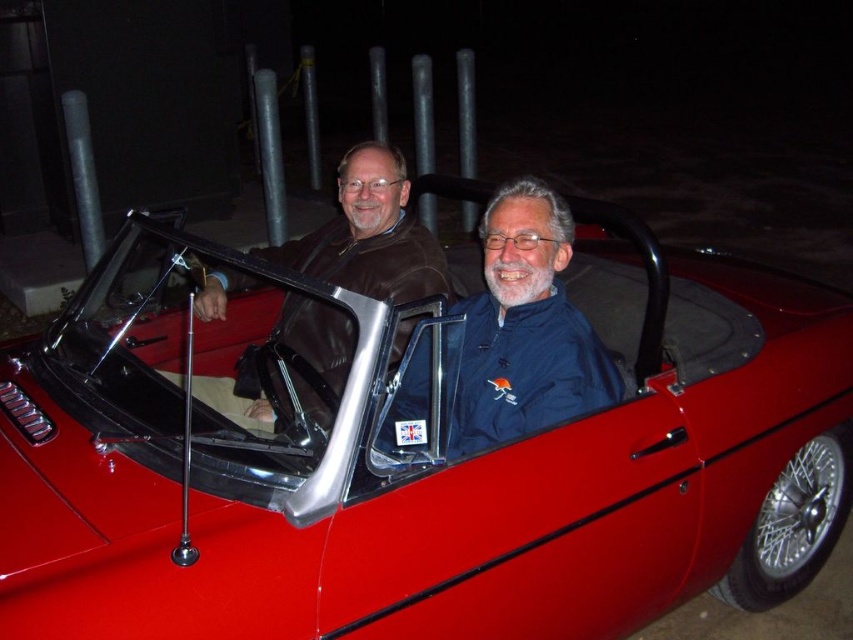
Question: Which of the following is the closest to the observer?

Choices:
 (A) shiny red convertible at center
 (B) brown leather jacket at center

Answer: (A)

Question: Which point appears farthest from the camera in this image?

Choices:
 (A) (323, 259)
 (B) (202, 404)
 (C) (538, 320)

Answer: (A)

Question: Is shiny red convertible at center to the right of blue fabric jacket at center from the viewer's perspective?

Choices:
 (A) yes
 (B) no

Answer: (B)

Question: Can you confirm if shiny red convertible at center is positioned to the left of blue fabric jacket at center?

Choices:
 (A) no
 (B) yes

Answer: (B)

Question: Is shiny red convertible at center closer to camera compared to brown leather jacket at center?

Choices:
 (A) yes
 (B) no

Answer: (A)

Question: Which object appears closest to the camera in this image?

Choices:
 (A) blue fabric jacket at center
 (B) shiny red convertible at center

Answer: (B)